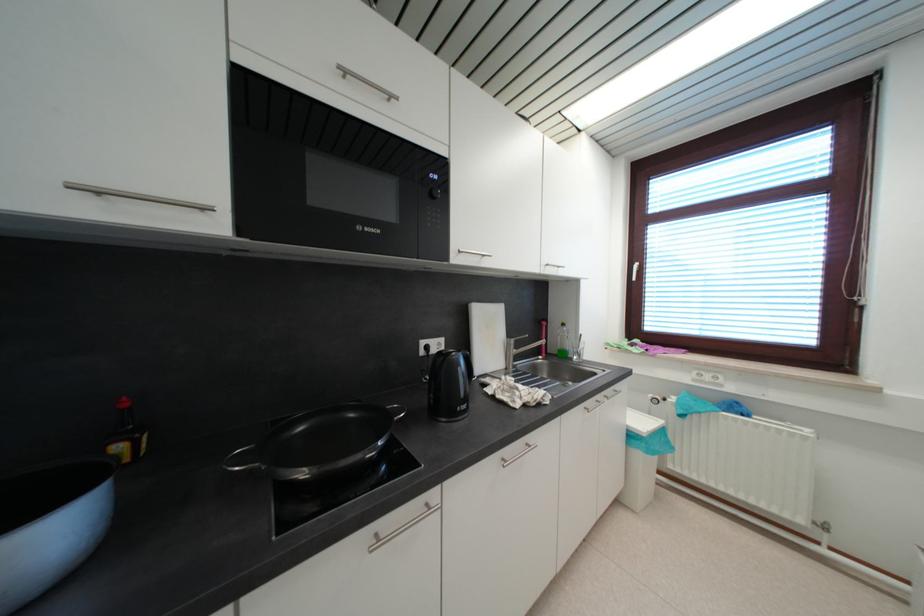
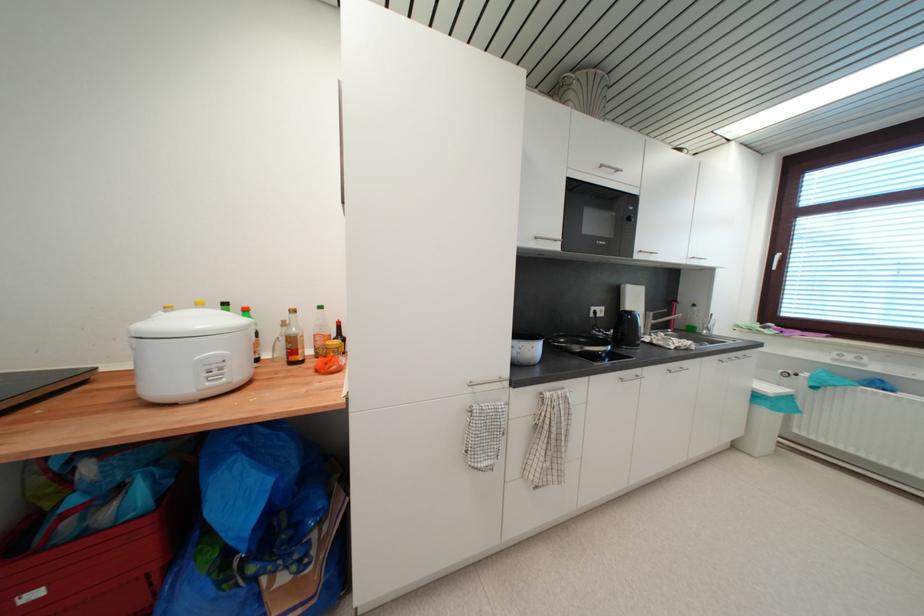
In the second image, find the point that corresponds to (428,355) in the first image.

(597, 317)